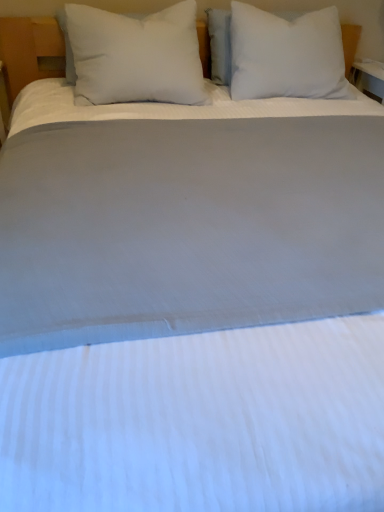
Question: Is white soft pillow at upper center, which is counted as the 1th pillow, starting from the right, not near white soft pillow at left, the 1th pillow positioned from the left?

Choices:
 (A) yes
 (B) no

Answer: (B)

Question: Is white soft pillow at upper center, the second pillow in the left-to-right sequence, positioned before white soft pillow at left, acting as the second pillow starting from the right?

Choices:
 (A) yes
 (B) no

Answer: (B)

Question: From the image's perspective, does white soft pillow at upper center, the second pillow in the left-to-right sequence, appear higher than white soft pillow at left, the 1th pillow positioned from the left?

Choices:
 (A) yes
 (B) no

Answer: (A)

Question: From a real-world perspective, is white soft pillow at upper center, which is counted as the 1th pillow, starting from the right, physically above white soft pillow at left, acting as the second pillow starting from the right?

Choices:
 (A) no
 (B) yes

Answer: (A)

Question: Does white soft pillow at upper center, which is counted as the 1th pillow, starting from the right, have a larger size compared to white soft pillow at left, acting as the second pillow starting from the right?

Choices:
 (A) no
 (B) yes

Answer: (B)

Question: Considering the relative sizes of white soft pillow at upper center, the second pillow in the left-to-right sequence, and white soft pillow at left, the 1th pillow positioned from the left, in the image provided, is white soft pillow at upper center, the second pillow in the left-to-right sequence, shorter than white soft pillow at left, the 1th pillow positioned from the left,?

Choices:
 (A) yes
 (B) no

Answer: (B)

Question: From the image's perspective, is white soft pillow at left, the 1th pillow positioned from the left, above white soft pillow at upper center, which is counted as the 1th pillow, starting from the right?

Choices:
 (A) no
 (B) yes

Answer: (A)

Question: Does white soft pillow at left, the 1th pillow positioned from the left, have a greater width compared to white soft pillow at upper center, the second pillow in the left-to-right sequence?

Choices:
 (A) no
 (B) yes

Answer: (B)

Question: Can you see white soft pillow at left, acting as the second pillow starting from the right, touching white soft pillow at upper center, which is counted as the 1th pillow, starting from the right?

Choices:
 (A) no
 (B) yes

Answer: (A)

Question: Considering the relative positions of white soft pillow at left, acting as the second pillow starting from the right, and white soft pillow at upper center, which is counted as the 1th pillow, starting from the right, in the image provided, is white soft pillow at left, acting as the second pillow starting from the right, to the left of white soft pillow at upper center, which is counted as the 1th pillow, starting from the right, from the viewer's perspective?

Choices:
 (A) no
 (B) yes

Answer: (B)

Question: Does white soft pillow at left, acting as the second pillow starting from the right, lie in front of white soft pillow at upper center, the second pillow in the left-to-right sequence?

Choices:
 (A) no
 (B) yes

Answer: (B)

Question: Is white soft pillow at left, acting as the second pillow starting from the right, surrounding white soft pillow at upper center, the second pillow in the left-to-right sequence?

Choices:
 (A) yes
 (B) no

Answer: (B)

Question: Considering their positions, is white soft pillow at upper center, which is counted as the 1th pillow, starting from the right, located in front of or behind white soft pillow at left, acting as the second pillow starting from the right?

Choices:
 (A) behind
 (B) front

Answer: (A)